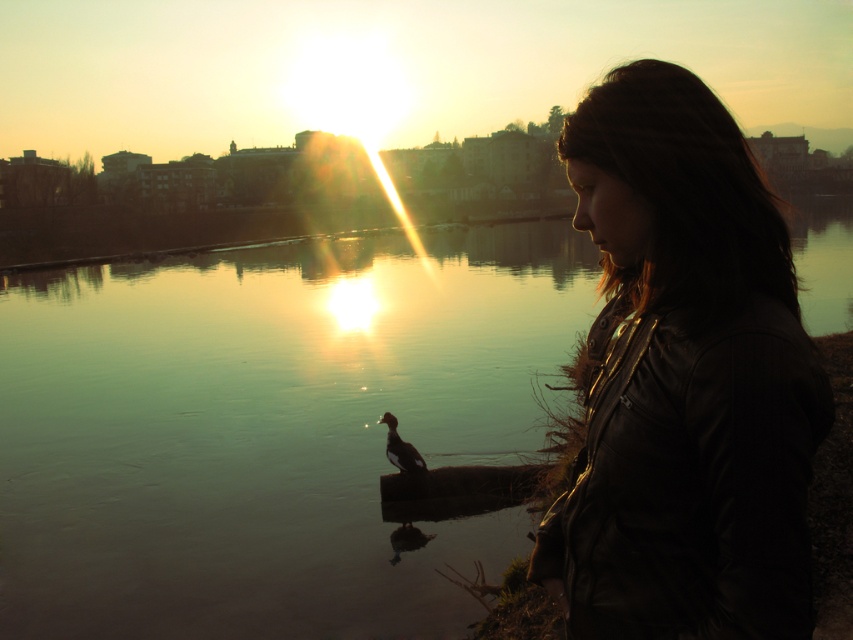
You are a photographer trying to capture the sunset scene. You notice the greenish water at center and the leather jacket at right in your viewfinder. Which object appears larger in the photo?

The greenish water at center appears larger in the photo because it is much taller than the leather jacket at right according to the description.